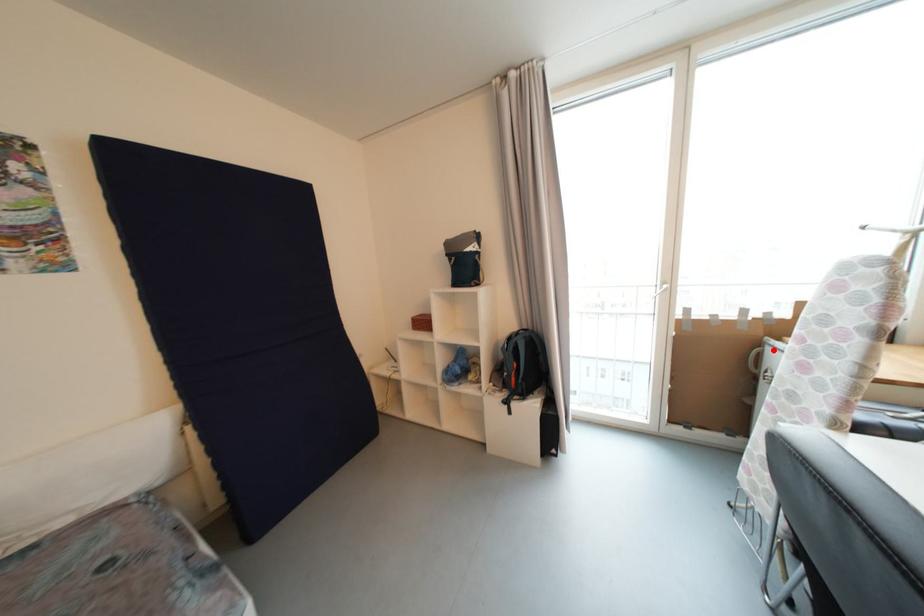
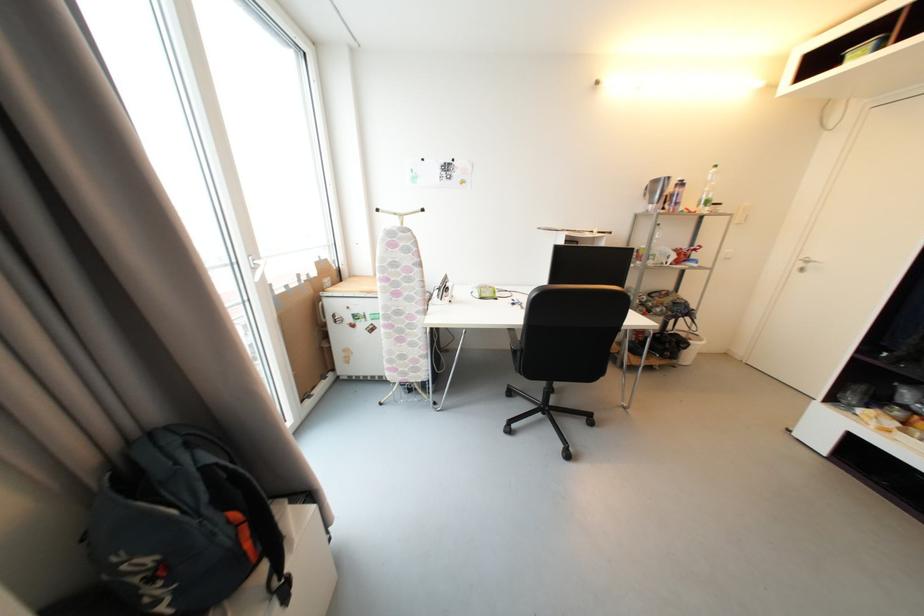
Find the pixel in the second image that matches the highlighted location in the first image.

(330, 302)